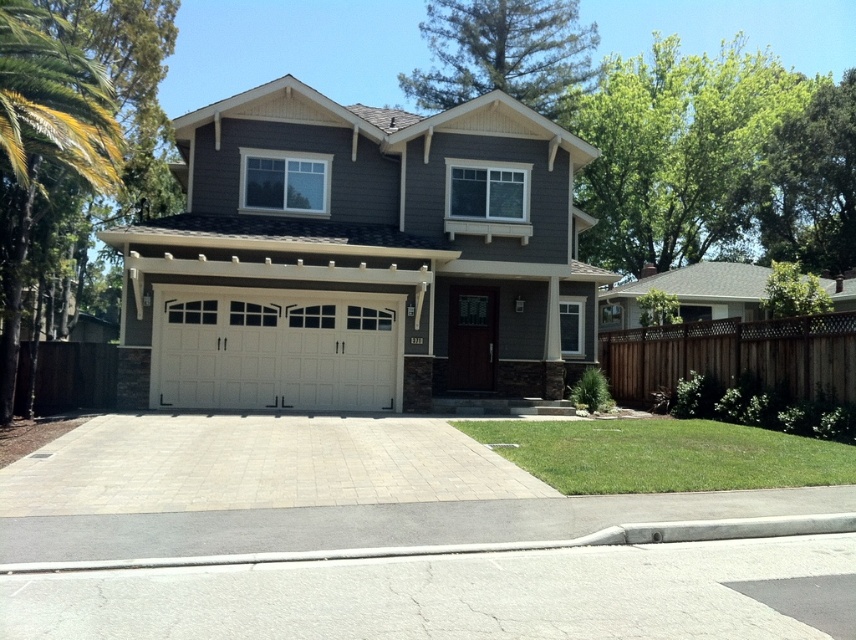
Between white wood garage door at center and green leafy palm tree at left, which one is positioned lower?

white wood garage door at center

Can you confirm if white wood garage door at center is taller than green leafy palm tree at left?

Indeed, white wood garage door at center has a greater height compared to green leafy palm tree at left.

Where is `white wood garage door at center`? The height and width of the screenshot is (640, 856). white wood garage door at center is located at coordinates (357, 259).

Is gray asphalt driveway at lower center taller than gray concrete driveway at center?

Indeed, gray asphalt driveway at lower center has a greater height compared to gray concrete driveway at center.

Describe the element at coordinates (450, 595) in the screenshot. I see `gray asphalt driveway at lower center` at that location.

Which is in front, point (294, 572) or point (342, 506)?

Point (294, 572)

Identify the location of gray asphalt driveway at lower center. This screenshot has height=640, width=856. (450, 595).

Can you confirm if white wood garage door at center is positioned below gray concrete driveway at center?

Actually, white wood garage door at center is above gray concrete driveway at center.

Which is above, white wood garage door at center or gray concrete driveway at center?

Positioned higher is white wood garage door at center.

What do you see at coordinates (357, 259) in the screenshot?
I see `white wood garage door at center` at bounding box center [357, 259].

Image resolution: width=856 pixels, height=640 pixels. In order to click on white wood garage door at center in this screenshot , I will do `click(357, 259)`.